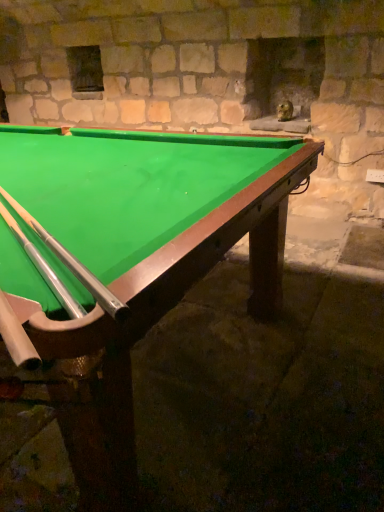
Identify the location of silver/smooth cue at lower left. (73, 265).

This screenshot has width=384, height=512. What do you see at coordinates (73, 265) in the screenshot? I see `silver/smooth cue at lower left` at bounding box center [73, 265].

Locate an element on the screen. This screenshot has height=512, width=384. green felt billiard table at center is located at coordinates (127, 261).

Describe the element at coordinates (127, 261) in the screenshot. The image size is (384, 512). I see `green felt billiard table at center` at that location.

Measure the distance between point (x=103, y=256) and camera.

Point (x=103, y=256) is 38.70 inches away from camera.

The height and width of the screenshot is (512, 384). Find the location of `silver/smooth cue at lower left`. silver/smooth cue at lower left is located at coordinates (73, 265).

Can you confirm if silver/smooth cue at lower left is positioned to the right of green felt billiard table at center?

Correct, you'll find silver/smooth cue at lower left to the right of green felt billiard table at center.

Which object is further away from the camera, silver/smooth cue at lower left or green felt billiard table at center?

silver/smooth cue at lower left is further away from the camera.

Considering the positions of points (96, 278) and (142, 272), is point (96, 278) closer to camera compared to point (142, 272)?

No, (96, 278) is further to viewer.

From the image's perspective, is silver/smooth cue at lower left positioned above or below green felt billiard table at center?

silver/smooth cue at lower left is situated higher than green felt billiard table at center in the image.

From a real-world perspective, is silver/smooth cue at lower left physically above green felt billiard table at center?

Yes, from a real-world perspective, silver/smooth cue at lower left is on top of green felt billiard table at center.

Does silver/smooth cue at lower left have a greater width compared to green felt billiard table at center?

No.

Can you confirm if silver/smooth cue at lower left is shorter than green felt billiard table at center?

Yes.

Does silver/smooth cue at lower left have a larger size compared to green felt billiard table at center?

No, silver/smooth cue at lower left is not bigger than green felt billiard table at center.

Consider the image. Does silver/smooth cue at lower left contain green felt billiard table at center?

Definitely not — green felt billiard table at center is not inside silver/smooth cue at lower left.

Does silver/smooth cue at lower left touch green felt billiard table at center?

They are not placed beside each other.

Could you tell me if silver/smooth cue at lower left is facing green felt billiard table at center?

Yes, silver/smooth cue at lower left is facing green felt billiard table at center.

Measure the distance from silver/smooth cue at lower left to green felt billiard table at center.

They are 20.47 inches apart.

Locate an element on the screen. The image size is (384, 512). cue lying on the right of green felt billiard table at center is located at coordinates (73, 265).

Which object is positioned more to the right, green felt billiard table at center or silver/smooth cue at lower left?

From the viewer's perspective, silver/smooth cue at lower left appears more on the right side.

Which object is closer to the camera, green felt billiard table at center or silver/smooth cue at lower left?

green felt billiard table at center is in front.

Which point is more forward, (116, 405) or (104, 300)?

The point (104, 300) is closer.

From the image's perspective, which one is positioned lower, green felt billiard table at center or silver/smooth cue at lower left?

green felt billiard table at center.

From a real-world perspective, which is physically below, green felt billiard table at center or silver/smooth cue at lower left?

From a 3D spatial view, green felt billiard table at center is below.

Which of these two, green felt billiard table at center or silver/smooth cue at lower left, is thinner?

Thinner between the two is silver/smooth cue at lower left.

Is green felt billiard table at center shorter than silver/smooth cue at lower left?

Incorrect, the height of green felt billiard table at center does not fall short of that of silver/smooth cue at lower left.

Is green felt billiard table at center bigger than silver/smooth cue at lower left?

Correct, green felt billiard table at center is larger in size than silver/smooth cue at lower left.

Is green felt billiard table at center located outside silver/smooth cue at lower left?

Yes, green felt billiard table at center is located beyond the bounds of silver/smooth cue at lower left.

Looking at this image, does green felt billiard table at center touch silver/smooth cue at lower left?

No, green felt billiard table at center is not making contact with silver/smooth cue at lower left.

Is green felt billiard table at center facing away from silver/smooth cue at lower left?

No, green felt billiard table at center's orientation is not away from silver/smooth cue at lower left.

At what (x,y) coordinates should I click in order to perform the action: click on billiard table directly beneath the silver/smooth cue at lower left (from a real-world perspective). Please return your answer as a coordinate pair (x, y). Looking at the image, I should click on (127, 261).

Find the location of a particular element. This screenshot has width=384, height=512. billiard table in front of the silver/smooth cue at lower left is located at coordinates (127, 261).

Image resolution: width=384 pixels, height=512 pixels. What are the coordinates of `billiard table that appears below the silver/smooth cue at lower left (from the image's perspective)` in the screenshot? It's located at (127, 261).